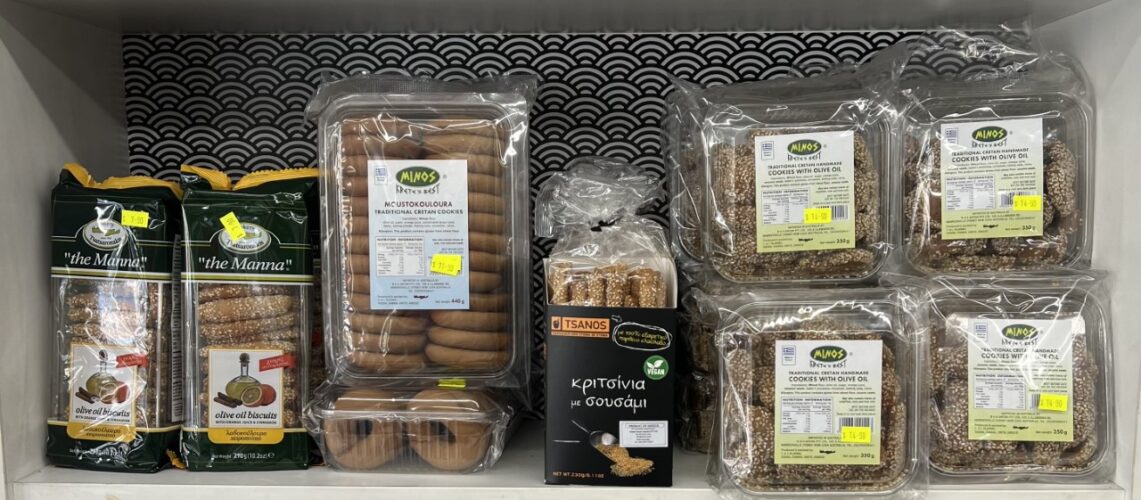
Locate an element on the screen. The width and height of the screenshot is (1141, 500). clear containers is located at coordinates (469, 304), (442, 424), (822, 404), (1039, 376), (953, 217), (817, 207).